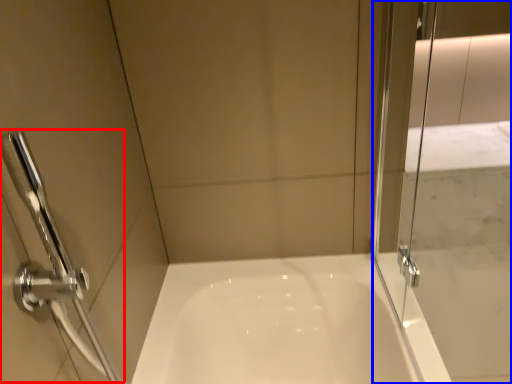
Question: Which of the following is the farthest to the observer, shower (highlighted by a red box) or screen door (highlighted by a blue box)?

Choices:
 (A) shower
 (B) screen door

Answer: (A)